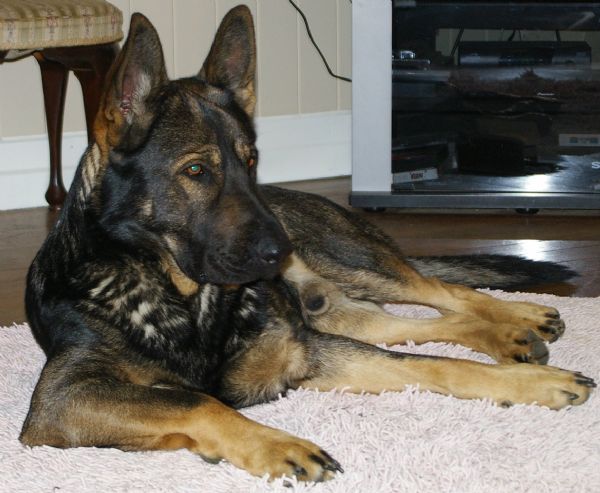
At what (x,y) coordinates should I click in order to perform the action: click on bench. Please return your answer as a coordinate pair (x, y). The width and height of the screenshot is (600, 493). Looking at the image, I should click on click(46, 23).